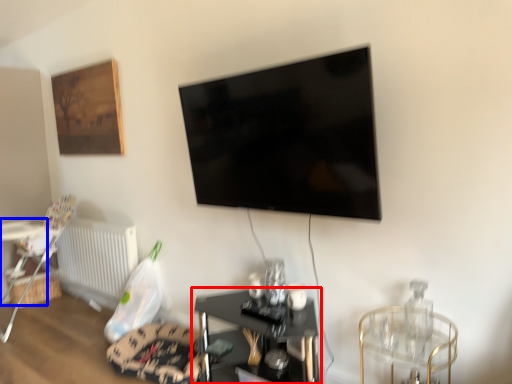
Question: Which object appears closest to the camera in this image, table (highlighted by a red box) or table (highlighted by a blue box)?

Choices:
 (A) table
 (B) table

Answer: (A)